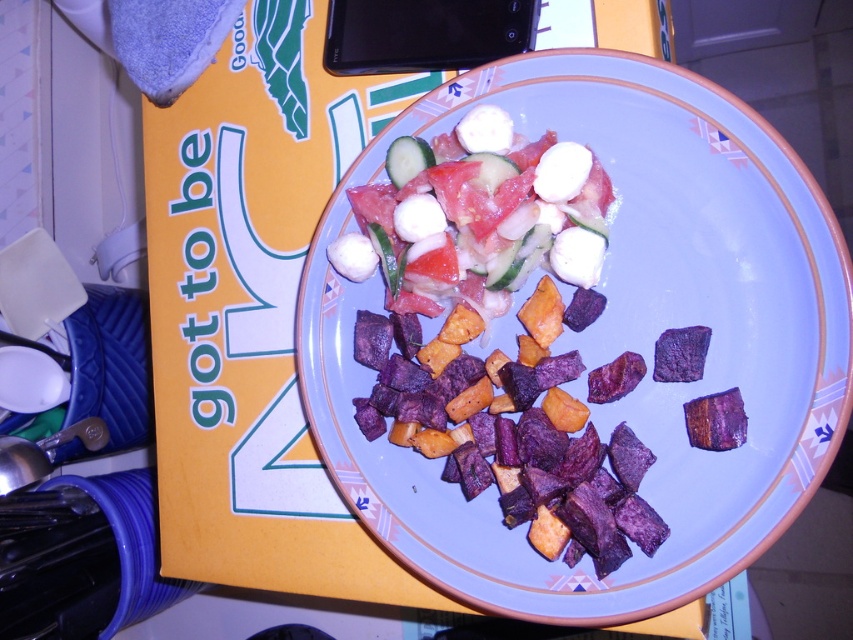
Question: Which of the following is the closest to the observer?

Choices:
 (A) (665, 572)
 (B) (556, 230)

Answer: (A)

Question: Which point is closer to the camera?

Choices:
 (A) fresh tomato salad with mozzarella at center
 (B) purple matte sweet potato cubes at center

Answer: (B)

Question: Is purple matte sweet potato cubes at center smaller than fresh tomato salad with mozzarella at center?

Choices:
 (A) yes
 (B) no

Answer: (B)

Question: Observing the image, what is the correct spatial positioning of purple matte sweet potato cubes at center in reference to fresh tomato salad with mozzarella at center?

Choices:
 (A) right
 (B) left

Answer: (A)

Question: Is purple matte sweet potato cubes at center wider than fresh tomato salad with mozzarella at center?

Choices:
 (A) yes
 (B) no

Answer: (A)